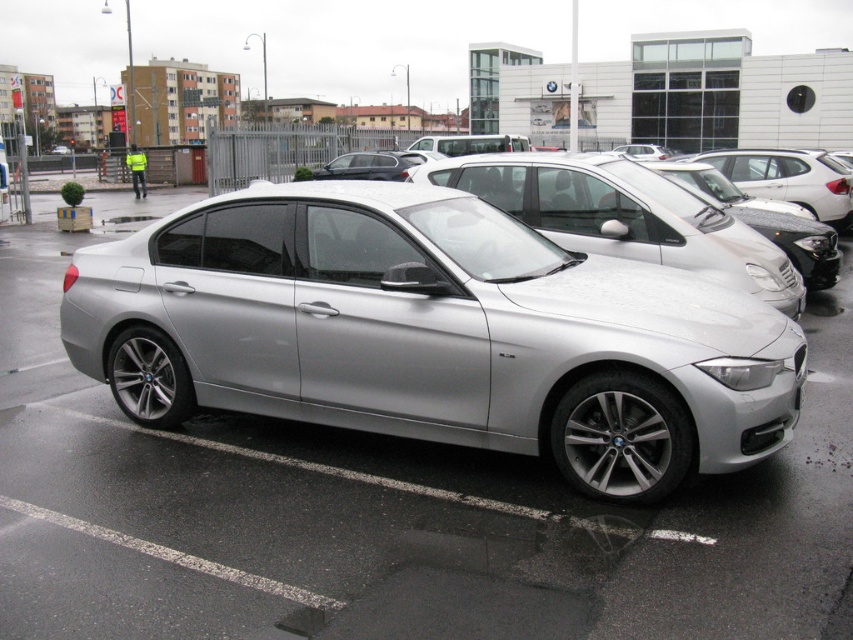
Question: Which point appears farthest from the camera in this image?

Choices:
 (A) (642, 209)
 (B) (792, 154)

Answer: (B)

Question: Observing the image, what is the correct spatial positioning of satin silver car at center in reference to satin silver sedan at center?

Choices:
 (A) above
 (B) below

Answer: (B)

Question: Can you confirm if satin silver car at center is wider than satin silver sedan at center?

Choices:
 (A) yes
 (B) no

Answer: (B)

Question: Among these objects, which one is nearest to the camera?

Choices:
 (A) satin silver sedan at center
 (B) satin silver car at center

Answer: (B)

Question: Is satin silver car at center behind satin silver sedan at center?

Choices:
 (A) yes
 (B) no

Answer: (B)